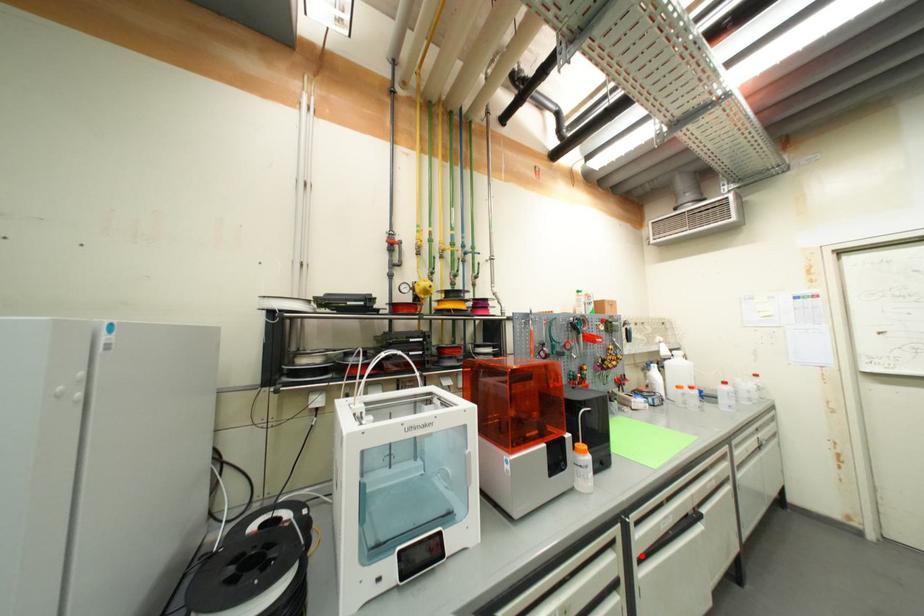
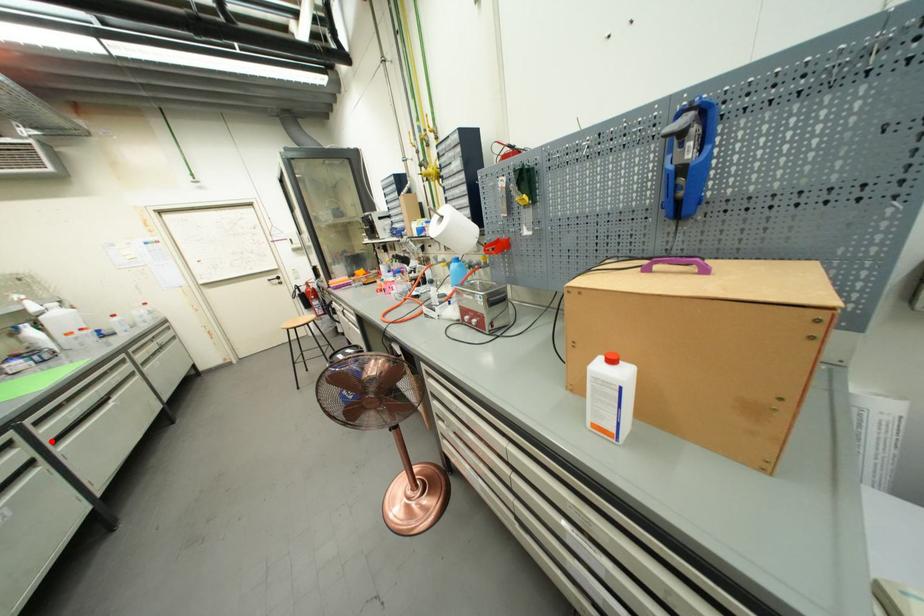
I am providing you with two images of the same scene from different viewpoints. A red point is marked on the first image and another point is marked on the second image. Does the point marked in image1 correspond to the same location as the one in image2?

Yes